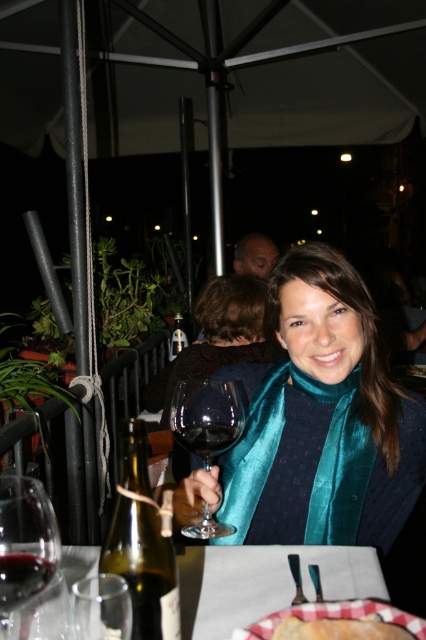
Does green glass bottle at lower left appear on the right side of transparent glass wine glass at center?

In fact, green glass bottle at lower left is to the left of transparent glass wine glass at center.

This screenshot has height=640, width=426. I want to click on green glass bottle at lower left, so coord(143,568).

Does green glass bottle at lower left have a greater height compared to transparent glass at lower left?

Yes, green glass bottle at lower left is taller than transparent glass at lower left.

Who is more distant from viewer, (x=178, y=625) or (x=43, y=579)?

Positioned behind is point (x=43, y=579).

Locate an element on the screen. green glass bottle at lower left is located at coordinates (143, 568).

Does green glass bottle at lower left appear on the left side of red glass at lower left?

Incorrect, green glass bottle at lower left is not on the left side of red glass at lower left.

Between point (120, 547) and point (16, 577), which one is positioned in front?

Point (16, 577)

Where is `green glass bottle at lower left`? This screenshot has width=426, height=640. green glass bottle at lower left is located at coordinates (143, 568).